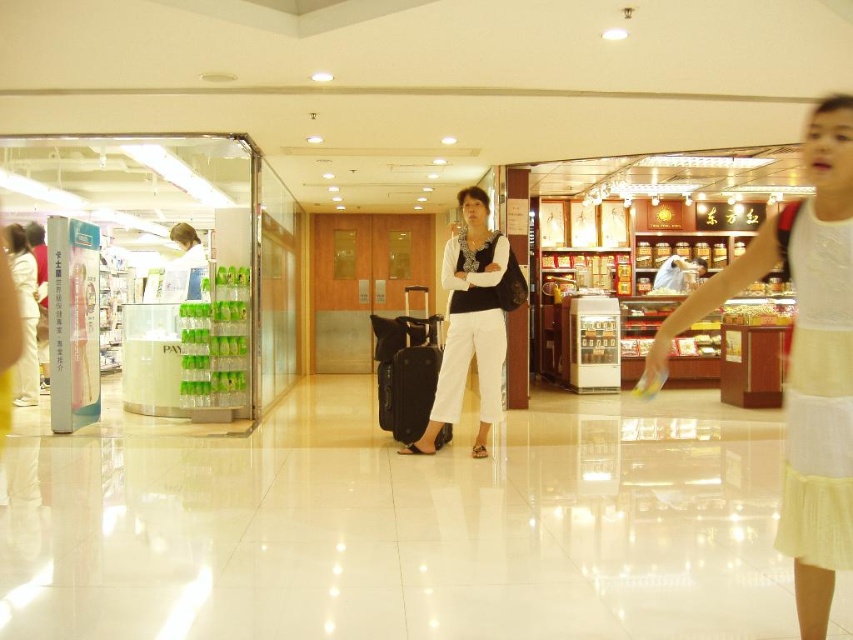
You are a store manager checking inventory. You need to place the white cotton dress at center and the black matte suitcase at center on a shelf. Which item requires more horizontal space on the shelf?

The white cotton dress at center requires more horizontal space because its width surpasses that of the black matte suitcase at center.

You are a salesperson in the mall and need to determine which clothing item is shorter between the white cotton dress at center and the white matte pants at center. Which one should you inform customers about?

The white cotton dress at center is shorter than the white matte pants at center.